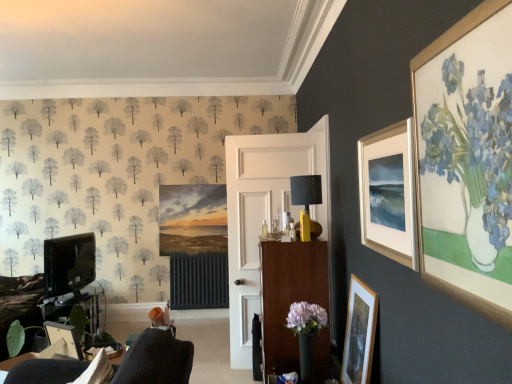
Question: Should I look upward or downward to see brown wood cabinet at center?

Choices:
 (A) down
 (B) up

Answer: (A)

Question: Can matte black tv at left be found inside brown wood cabinet at center?

Choices:
 (A) yes
 (B) no

Answer: (B)

Question: From a real-world perspective, is brown wood cabinet at center positioned over matte black tv at left based on gravity?

Choices:
 (A) yes
 (B) no

Answer: (B)

Question: Can you confirm if brown wood cabinet at center is taller than matte black tv at left?

Choices:
 (A) no
 (B) yes

Answer: (B)

Question: Does brown wood cabinet at center lie behind matte black tv at left?

Choices:
 (A) no
 (B) yes

Answer: (A)

Question: Is brown wood cabinet at center bigger than matte black tv at left?

Choices:
 (A) yes
 (B) no

Answer: (A)

Question: Is brown wood cabinet at center thinner than matte black tv at left?

Choices:
 (A) yes
 (B) no

Answer: (B)

Question: Does matte white picture frame at upper right, which is the first picture frame from right to left, have a smaller size compared to matte black tv at left?

Choices:
 (A) yes
 (B) no

Answer: (A)

Question: Can you confirm if matte white picture frame at upper right, placed as the 1th picture frame when sorted from top to bottom, is wider than matte black tv at left?

Choices:
 (A) yes
 (B) no

Answer: (B)

Question: Is matte white picture frame at upper right, which is the first picture frame from right to left, positioned before matte black tv at left?

Choices:
 (A) no
 (B) yes

Answer: (B)

Question: Is matte white picture frame at upper right, the 3th picture frame ordered from the bottom, completely or partially outside of matte black tv at left?

Choices:
 (A) yes
 (B) no

Answer: (A)

Question: From a real-world perspective, does matte white picture frame at upper right, placed as the 1th picture frame when sorted from top to bottom, sit lower than matte black tv at left?

Choices:
 (A) no
 (B) yes

Answer: (A)

Question: From the image's perspective, is matte white picture frame at upper right, placed as the third picture frame when sorted from left to right, above matte black tv at left?

Choices:
 (A) no
 (B) yes

Answer: (B)

Question: Is matte black tv at left shorter than matte white picture frame at upper right, placed as the 1th picture frame when sorted from top to bottom?

Choices:
 (A) yes
 (B) no

Answer: (A)